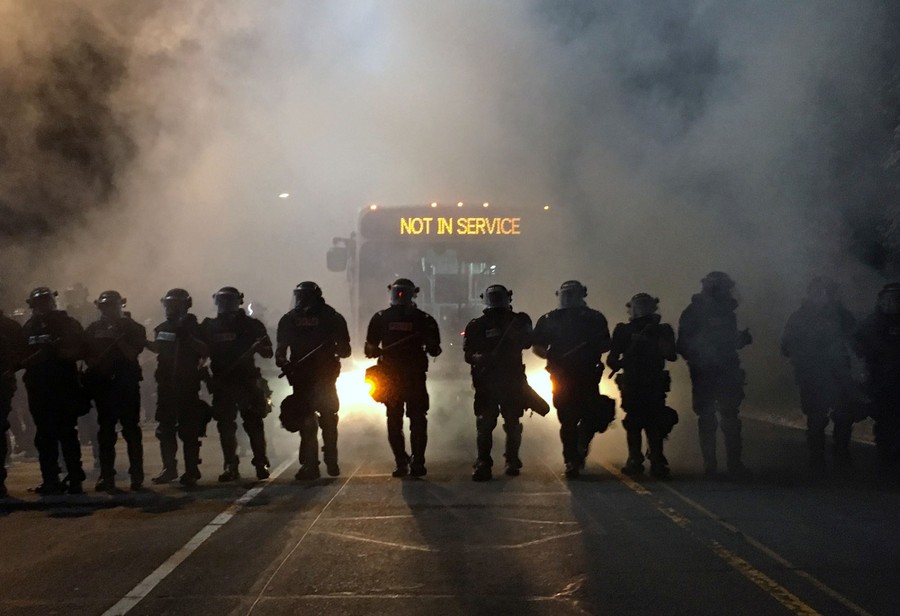
This screenshot has height=616, width=900. In order to click on light in this screenshot , I will do `click(533, 377)`.